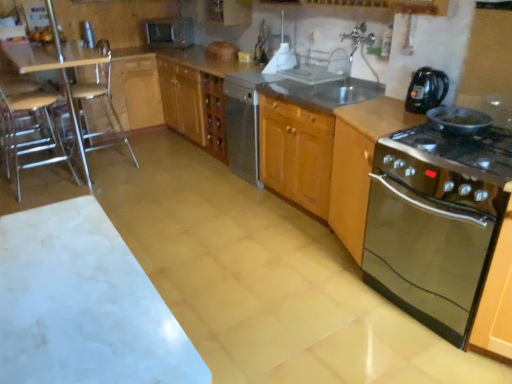
Image resolution: width=512 pixels, height=384 pixels. Identify the location of vacant point above white marble table at lower left, which ranks as the 2th table in back-to-front order (from a real-world perspective). (60, 285).